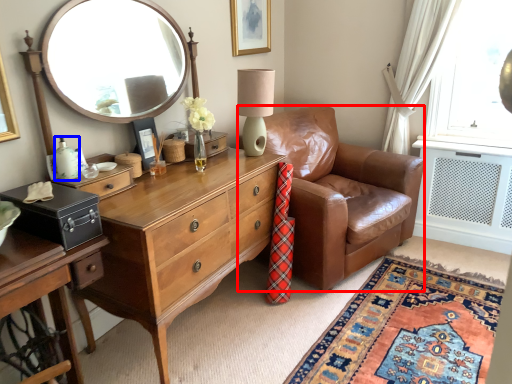
Question: Which point is further to the camera, chair (highlighted by a red box) or bottle (highlighted by a blue box)?

Choices:
 (A) chair
 (B) bottle

Answer: (A)